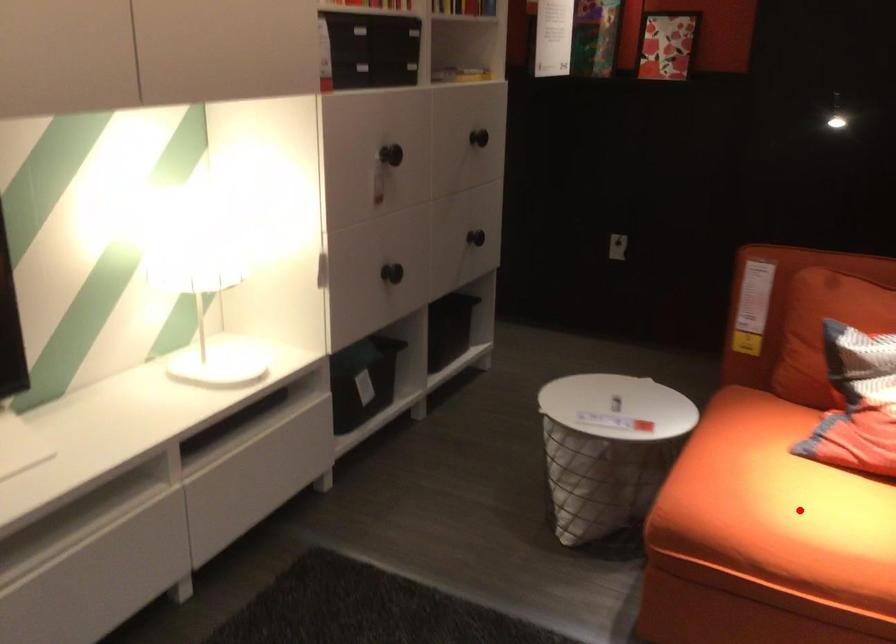
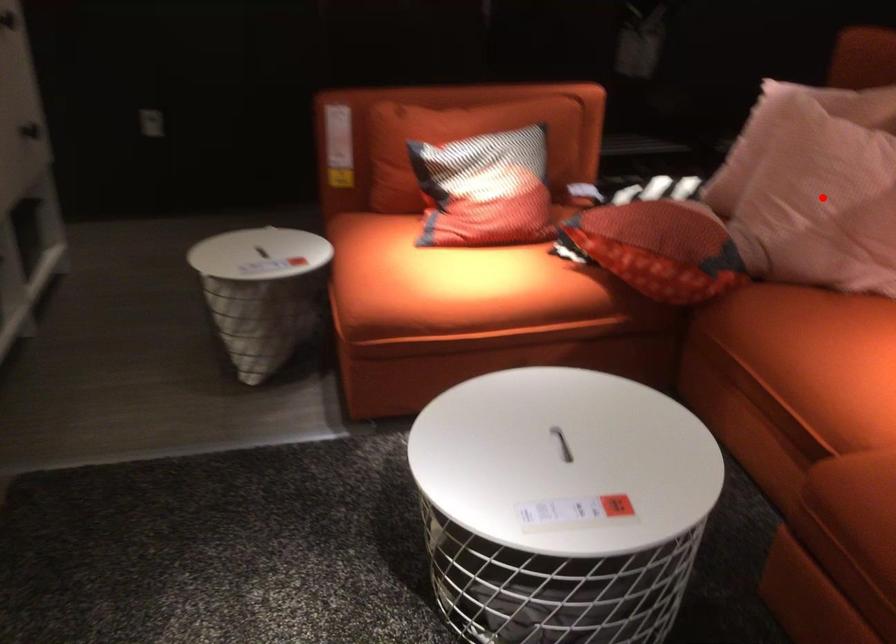
I am providing you with two images of the same scene from different viewpoints. A red point is marked on the first image and another point is marked on the second image. Is the red point in image1 aligned with the point shown in image2?

No